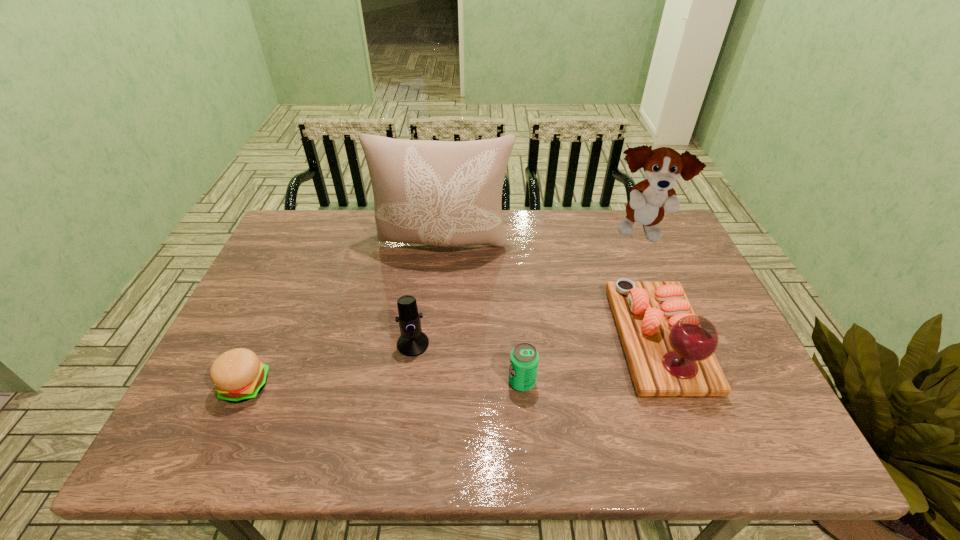
The image size is (960, 540). Find the location of `object that is at the far right corner`. object that is at the far right corner is located at coordinates (649, 199).

Image resolution: width=960 pixels, height=540 pixels. What are the coordinates of `vacant region at the far edge of the desktop` in the screenshot? It's located at (373, 215).

Where is `vacant space at the near edge`? Image resolution: width=960 pixels, height=540 pixels. vacant space at the near edge is located at coordinates (371, 426).

Where is `vacant space at the left edge of the desktop`? This screenshot has width=960, height=540. vacant space at the left edge of the desktop is located at coordinates (265, 279).

Identify the location of vacant space at the right edge. (685, 274).

I want to click on free space at the far left corner of the desktop, so click(x=300, y=225).

Where is `free spot between the microphone and the pop soda`? free spot between the microphone and the pop soda is located at coordinates (468, 363).

Image resolution: width=960 pixels, height=540 pixels. What are the coordinates of `vacant space in between the tallest object and the shortest object` in the screenshot? It's located at (345, 315).

Where is `unoccupied area between the fifth tallest object and the second tallest object`? The height and width of the screenshot is (540, 960). unoccupied area between the fifth tallest object and the second tallest object is located at coordinates (581, 308).

Find the location of a particular element. Image resolution: width=960 pixels, height=540 pixels. blank region between the cushion and the pop soda is located at coordinates (483, 313).